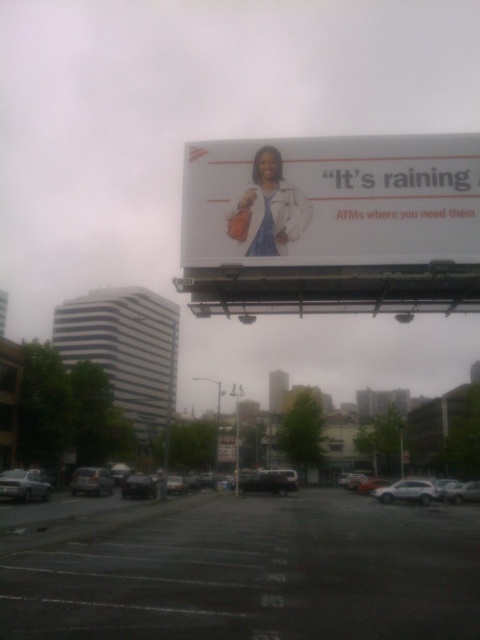
You are standing on the sidewalk looking at the billboard and the parked cars. There are two points marked on the image at coordinates point (x=414, y=492) and point (x=222, y=452). Which point is closer to your current position?

Point (x=414, y=492) is closer to the camera than point (x=222, y=452), so the point at (x=414, y=492) is closer to your current position.

You are standing at the point marked by the coordinates (407, 492) in the image. What object is located at that exact point?

The white matte car at lower right is located at point (407, 492).